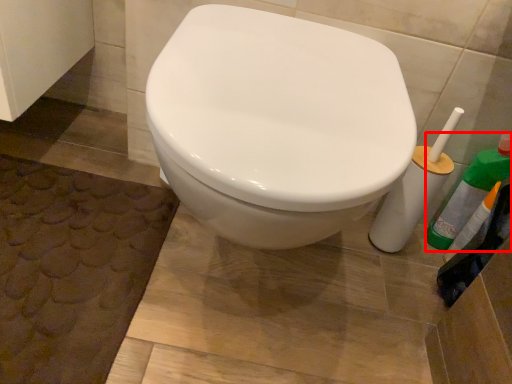
Question: From the image's perspective, what is the correct spatial positioning of cleaning product (annotated by the red box) in reference to bath mat?

Choices:
 (A) below
 (B) above

Answer: (B)